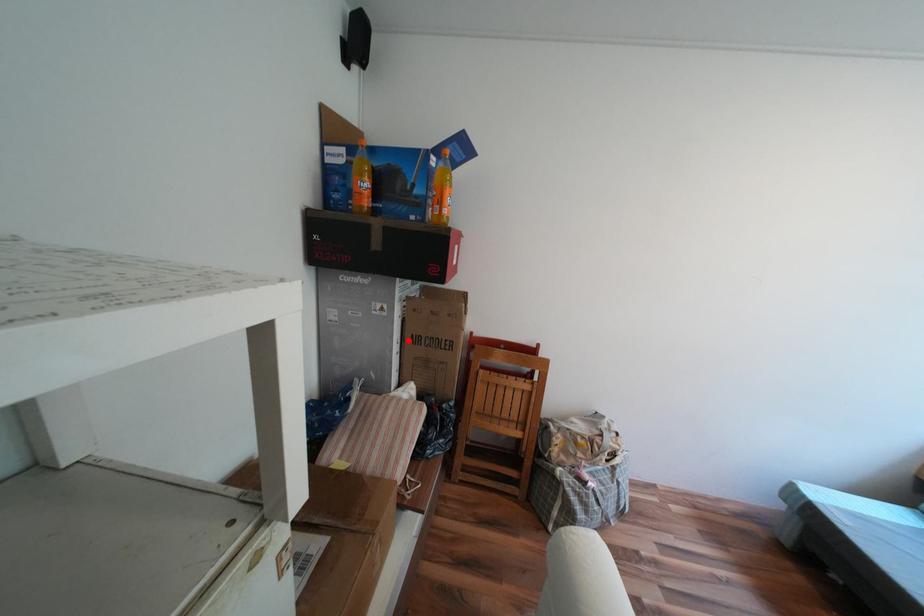
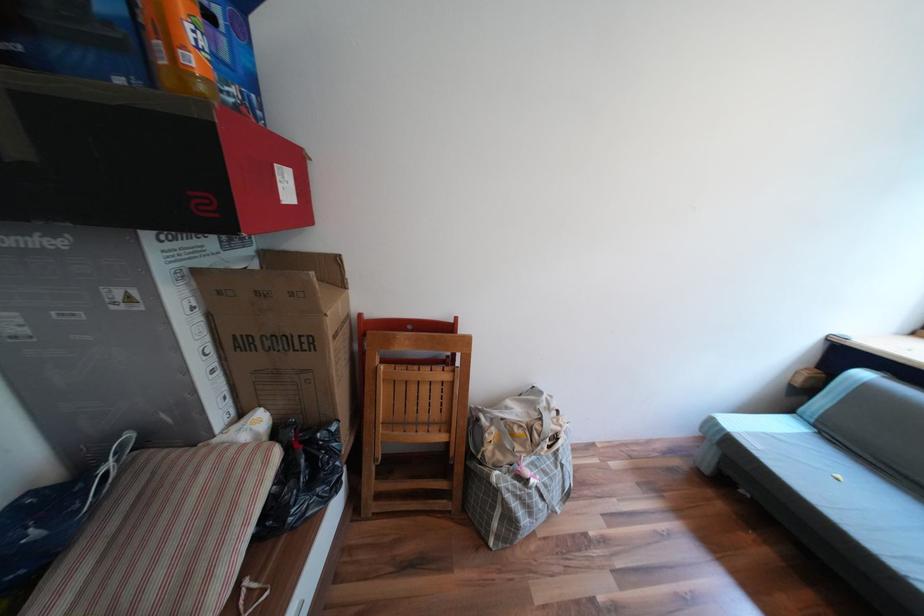
Find the pixel in the second image that matches the highlighted location in the first image.

(219, 349)